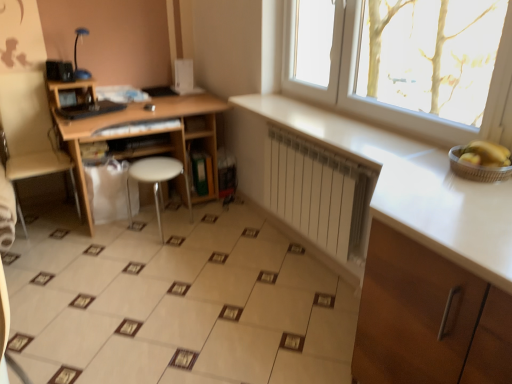
Question: From the image's perspective, is blue glossy lamp at upper left above or below metallic silver basket at right?

Choices:
 (A) above
 (B) below

Answer: (A)

Question: Based on their sizes in the image, would you say blue glossy lamp at upper left is bigger or smaller than metallic silver basket at right?

Choices:
 (A) small
 (B) big

Answer: (B)

Question: Which object is positioned farthest from the metallic silver basket at right?

Choices:
 (A) beige fabric swivel chair at left
 (B) white plastic stool at center
 (C) beige ceramic tile at center
 (D) yellow matte banana at right
 (E) white wood cabinet at lower right

Answer: (A)

Question: Estimate the real-world distances between objects in this image. Which object is closer to the beige ceramic tile at center?

Choices:
 (A) white wood cabinet at lower right
 (B) metallic silver basket at right
 (C) beige fabric swivel chair at left
 (D) white matte radiator at center
 (E) white plastic stool at center

Answer: (D)